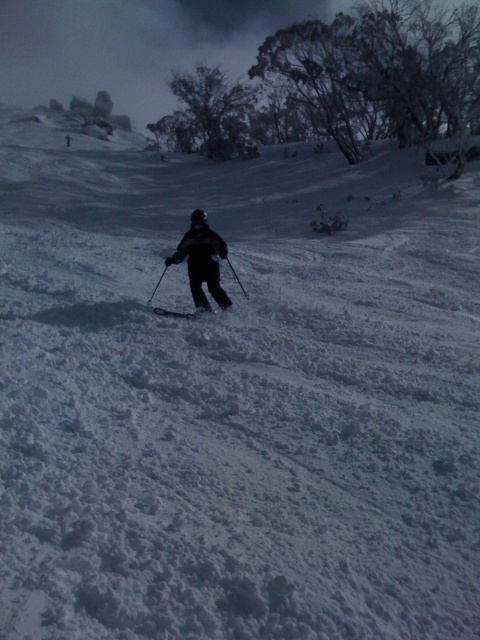
Does dark gray ski suit at center appear over matte black ski at center?

Correct, dark gray ski suit at center is located above matte black ski at center.

This screenshot has height=640, width=480. What do you see at coordinates (202, 260) in the screenshot? I see `dark gray ski suit at center` at bounding box center [202, 260].

The width and height of the screenshot is (480, 640). What do you see at coordinates (202, 260) in the screenshot? I see `dark gray ski suit at center` at bounding box center [202, 260].

Find the location of `dark gray ski suit at center`. dark gray ski suit at center is located at coordinates (202, 260).